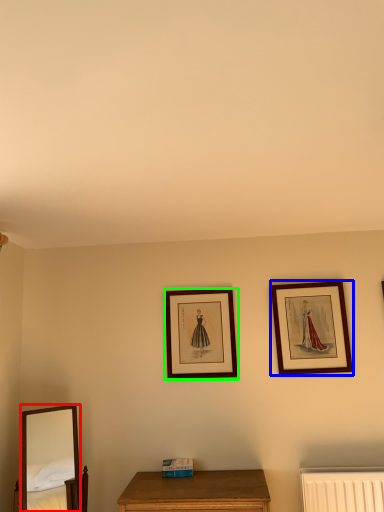
Question: Based on their relative distances, which object is nearer to mirror (highlighted by a red box)? Choose from picture frame (highlighted by a blue box) and picture frame (highlighted by a green box).

Choices:
 (A) picture frame
 (B) picture frame

Answer: (B)